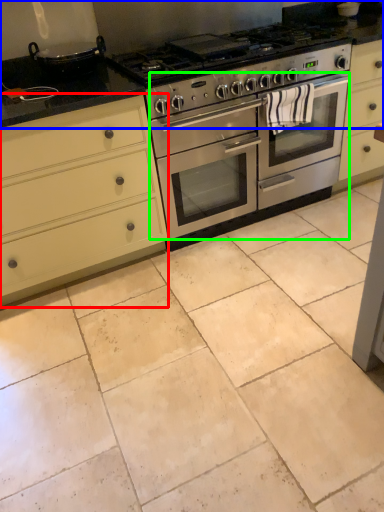
Question: Based on their relative distances, which object is nearer to cabinetry (highlighted by a red box)? Choose from countertop (highlighted by a blue box) and oven (highlighted by a green box).

Choices:
 (A) countertop
 (B) oven

Answer: (B)